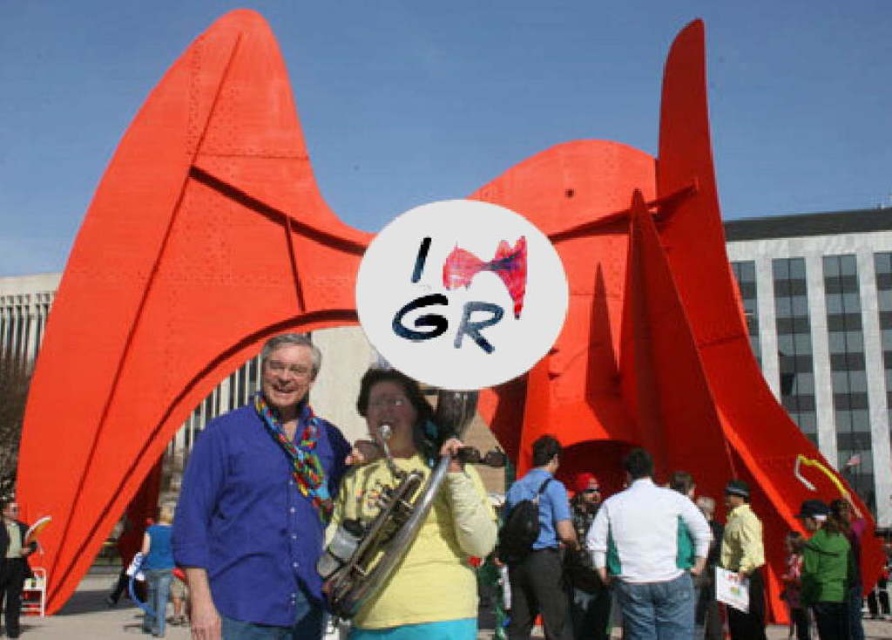
From the picture: You are standing at the base of the large red sculpture and want to take a photo of the blue cotton shirt at center and the person with the trombone. How far apart are these two subjects in feet?

The blue cotton shirt at center and the person with the trombone are 162.16 feet apart.